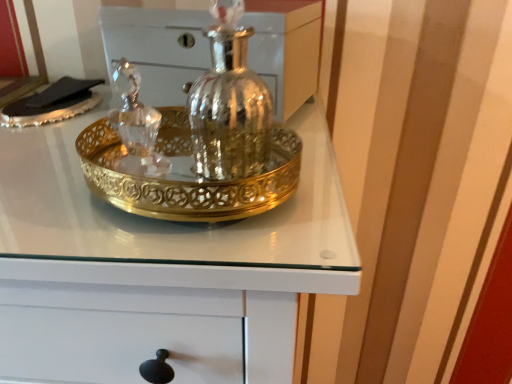
The width and height of the screenshot is (512, 384). Describe the element at coordinates (158, 48) in the screenshot. I see `polished silver vase at center` at that location.

Identify the location of polished silver vase at center. This screenshot has width=512, height=384. (158, 48).

What is the approximate height of gold metallic tray at center?

7.11 inches.

What do you see at coordinates (178, 252) in the screenshot? I see `gold metallic tray at center` at bounding box center [178, 252].

The width and height of the screenshot is (512, 384). Identify the location of gold metallic tray at center. (178, 252).

In the scene shown: Measure the distance between point [242,294] and camera.

Point [242,294] is 13.86 inches away from camera.

Locate an element on the screen. polished silver vase at center is located at coordinates (158, 48).

Considering the positions of objects polished silver vase at center and gold metallic tray at center in the image provided, who is more to the right, polished silver vase at center or gold metallic tray at center?

Positioned to the right is polished silver vase at center.

Which object is closer to the camera, polished silver vase at center or gold metallic tray at center?

gold metallic tray at center is closer to the camera.

Which point is more distant from viewer, (x=123, y=18) or (x=79, y=330)?

Positioned behind is point (x=123, y=18).

From the image's perspective, who appears lower, polished silver vase at center or gold metallic tray at center?

gold metallic tray at center, from the image's perspective.

From a real-world perspective, is polished silver vase at center physically located above or below gold metallic tray at center?

polished silver vase at center is situated lower than gold metallic tray at center in the real world.

Does polished silver vase at center have a greater width compared to gold metallic tray at center?

No, polished silver vase at center is not wider than gold metallic tray at center.

Does polished silver vase at center have a lesser height compared to gold metallic tray at center?

Yes.

Does polished silver vase at center have a larger size compared to gold metallic tray at center?

No.

Is polished silver vase at center inside the boundaries of gold metallic tray at center, or outside?

polished silver vase at center is not enclosed by gold metallic tray at center.

Is polished silver vase at center far away from gold metallic tray at center?

polished silver vase at center is near gold metallic tray at center, not far away.

Is polished silver vase at center facing away from gold metallic tray at center?

No, gold metallic tray at center is not at the back of polished silver vase at center.

What's the angular difference between polished silver vase at center and gold metallic tray at center's facing directions?

The angular difference between polished silver vase at center and gold metallic tray at center is 4.36 degrees.

The width and height of the screenshot is (512, 384). What are the coordinates of `chest located on the right of gold metallic tray at center` in the screenshot? It's located at (158, 48).

Is gold metallic tray at center to the left of polished silver vase at center from the viewer's perspective?

Indeed, gold metallic tray at center is positioned on the left side of polished silver vase at center.

Which object is more forward, gold metallic tray at center or polished silver vase at center?

gold metallic tray at center is closer to the camera.

Considering the points (251, 265) and (283, 60), which point is behind, point (251, 265) or point (283, 60)?

The point (283, 60) is more distant.

From the image's perspective, which one is positioned higher, gold metallic tray at center or polished silver vase at center?

polished silver vase at center is shown above in the image.

From a real-world perspective, which is physically below, gold metallic tray at center or polished silver vase at center?

polished silver vase at center is physically lower.

In terms of width, does gold metallic tray at center look wider or thinner when compared to polished silver vase at center?

In the image, gold metallic tray at center appears to be wider than polished silver vase at center.

Does gold metallic tray at center have a greater height compared to polished silver vase at center?

Yes, gold metallic tray at center is taller than polished silver vase at center.

Can you confirm if gold metallic tray at center is bigger than polished silver vase at center?

Yes, gold metallic tray at center is bigger than polished silver vase at center.

Is gold metallic tray at center situated inside polished silver vase at center or outside?

The correct answer is: outside.

Is gold metallic tray at center far from polished silver vase at center?

That's not correct — gold metallic tray at center is a little close to polished silver vase at center.

Is gold metallic tray at center aimed at polished silver vase at center?

No, gold metallic tray at center is not turned towards polished silver vase at center.

How many degrees apart are the facing directions of gold metallic tray at center and polished silver vase at center?

The angle between the facing direction of gold metallic tray at center and the facing direction of polished silver vase at center is 4.36 degrees.

Find the location of a particular element. the chest that appears above the gold metallic tray at center (from the image's perspective) is located at coordinates (158, 48).

Locate an element on the screen. Image resolution: width=512 pixels, height=384 pixels. chest above the gold metallic tray at center (from the image's perspective) is located at coordinates (158, 48).

Locate an element on the screen. the chest of drawers located below the polished silver vase at center (from the image's perspective) is located at coordinates (178, 252).